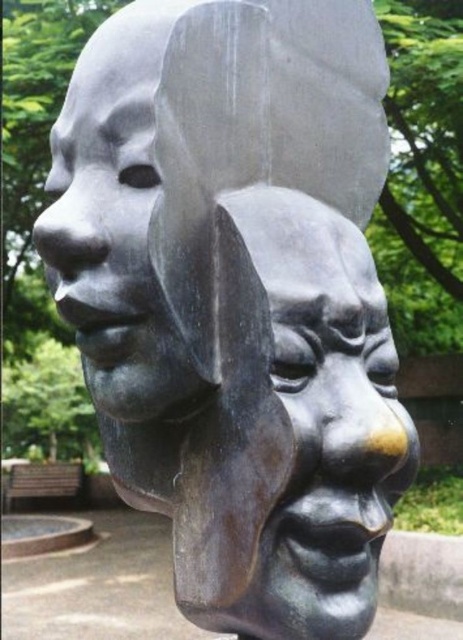
You are an art curator examining the sculpture. You need to place a protective cover over the shiny bronze mask at center and the matte bronze face at upper left. Since the cover can only be placed over one object at a time, which object should you cover first if you want to protect the one that is positioned higher up?

The matte bronze face at upper left is positioned higher up than the shiny bronze mask at center, so you should cover the matte bronze face at upper left first.

You are an art conservator examining the sculpture. You notice two points on the sculpture at coordinates point (327, 253) and point (101, 330). Which point is closer to the viewer?

Point (101, 330) is closer to the viewer because it is in front of point (327, 253).

You are an art curator planning to display the shiny bronze mask at center and the matte bronze face at upper left in a new exhibition. Given their sizes, which one should be placed on the higher pedestal to ensure both are visible from the front entrance?

The shiny bronze mask at center is larger in size than the matte bronze face at upper left, so placing the matte bronze face at upper left on a higher pedestal will ensure both are visible from the front entrance.